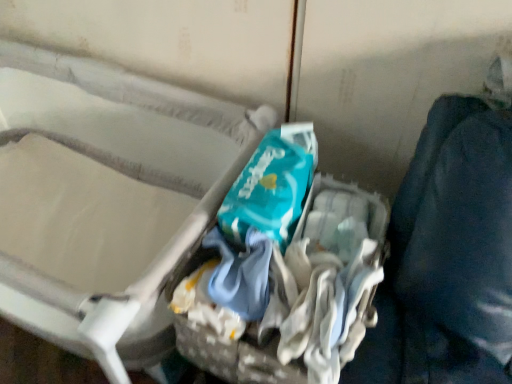
Question: Should I look upward or downward to see teal fabric bag at center?

Choices:
 (A) up
 (B) down

Answer: (B)

Question: From a real-world perspective, is white fabric crib at upper left under teal fabric bag at center?

Choices:
 (A) no
 (B) yes

Answer: (B)

Question: Is white fabric crib at upper left placed right next to teal fabric bag at center?

Choices:
 (A) no
 (B) yes

Answer: (A)

Question: Is white fabric crib at upper left further to camera compared to teal fabric bag at center?

Choices:
 (A) no
 (B) yes

Answer: (A)

Question: Is white fabric crib at upper left thinner than teal fabric bag at center?

Choices:
 (A) no
 (B) yes

Answer: (A)

Question: Considering the relative sizes of white fabric crib at upper left and teal fabric bag at center in the image provided, is white fabric crib at upper left shorter than teal fabric bag at center?

Choices:
 (A) no
 (B) yes

Answer: (A)

Question: Is white fabric crib at upper left turned away from teal fabric bag at center?

Choices:
 (A) yes
 (B) no

Answer: (B)

Question: Can you confirm if teal fabric bag at center is wider than white fabric crib at upper left?

Choices:
 (A) yes
 (B) no

Answer: (B)

Question: Can you confirm if teal fabric bag at center is shorter than white fabric crib at upper left?

Choices:
 (A) yes
 (B) no

Answer: (A)

Question: Can you confirm if teal fabric bag at center is positioned to the right of white fabric crib at upper left?

Choices:
 (A) no
 (B) yes

Answer: (B)

Question: Does teal fabric bag at center have a greater height compared to white fabric crib at upper left?

Choices:
 (A) yes
 (B) no

Answer: (B)

Question: Can you confirm if teal fabric bag at center is bigger than white fabric crib at upper left?

Choices:
 (A) yes
 (B) no

Answer: (B)

Question: Is white fabric crib at upper left inside teal fabric bag at center?

Choices:
 (A) yes
 (B) no

Answer: (B)

Question: From their relative heights in the image, would you say teal fabric bag at center is taller or shorter than white fabric crib at upper left?

Choices:
 (A) tall
 (B) short

Answer: (B)